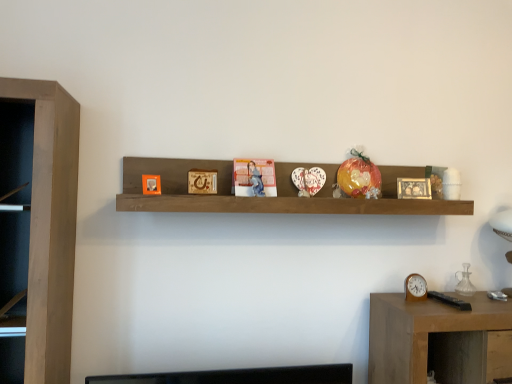
Find the location of a particular element. Image resolution: width=512 pixels, height=384 pixels. vacant space to the left of wooden clock at right is located at coordinates (388, 301).